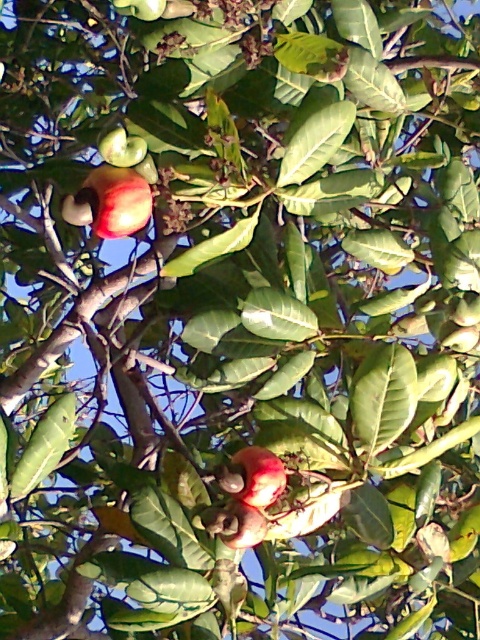
You are an apple picker and need to determine which shiny red apple is taller. You see the shiny red apple at upper left and the shiny red apple at center. Which one is taller?

The shiny red apple at upper left is taller than the shiny red apple at center.